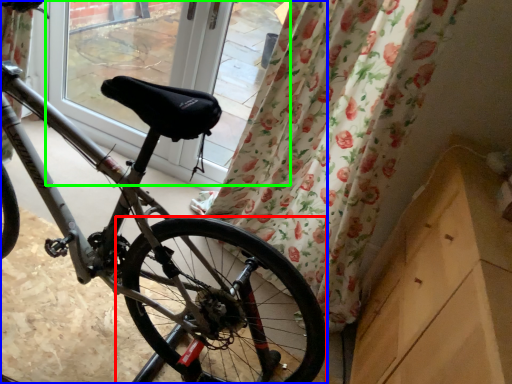
Question: Considering the real-world distances, which object is farthest from wheel (highlighted by a red box)? bicycle (highlighted by a blue box) or window screen (highlighted by a green box)?

Choices:
 (A) bicycle
 (B) window screen

Answer: (B)